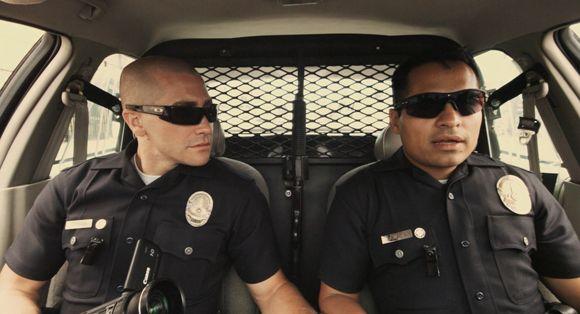
Where is `windows`? Image resolution: width=580 pixels, height=314 pixels. windows is located at coordinates (6, 42), (108, 79), (495, 75).